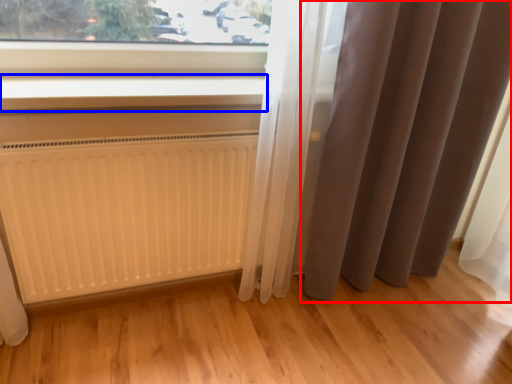
Question: Which object appears farthest to the camera in this image, curtain (highlighted by a red box) or window sill (highlighted by a blue box)?

Choices:
 (A) curtain
 (B) window sill

Answer: (B)